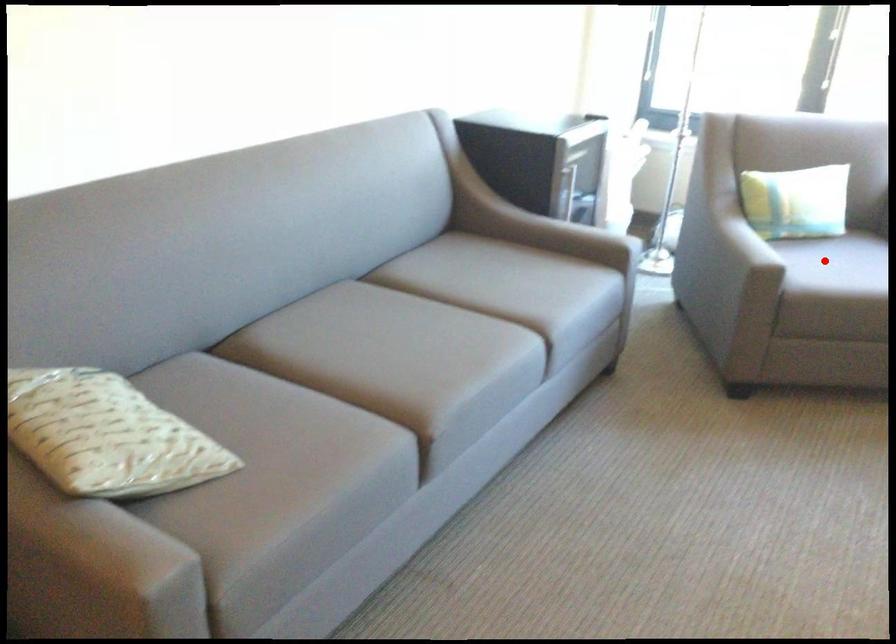
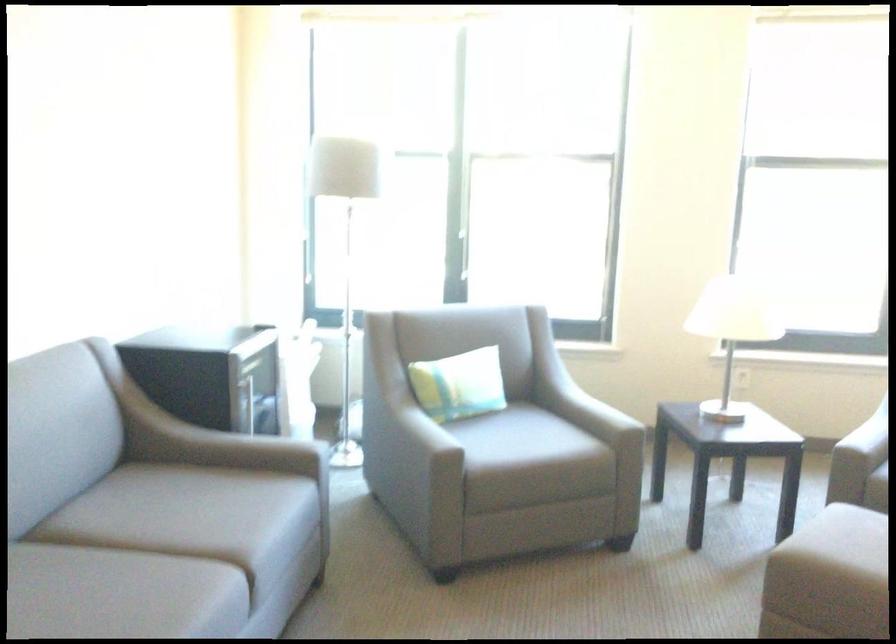
Locate, in the second image, the point that corresponds to the highlighted location in the first image.

(495, 431)